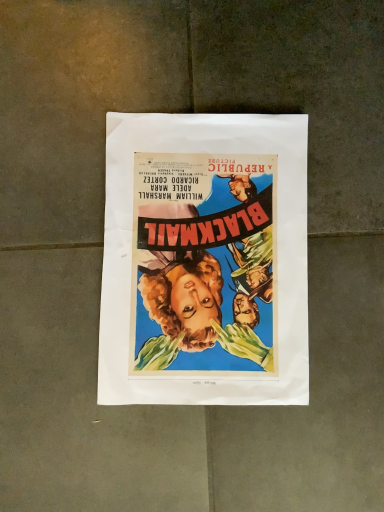
What is the approximate width of vintage paper poster at center?

It is 12.06 inches.

At what (x,y) coordinates should I click in order to perform the action: click on vintage paper poster at center. Please return your answer as a coordinate pair (x, y). Looking at the image, I should click on (205, 261).

This screenshot has width=384, height=512. What do you see at coordinates (205, 261) in the screenshot?
I see `vintage paper poster at center` at bounding box center [205, 261].

Locate an element on the screen. This screenshot has height=512, width=384. vintage paper poster at center is located at coordinates pyautogui.click(x=205, y=261).